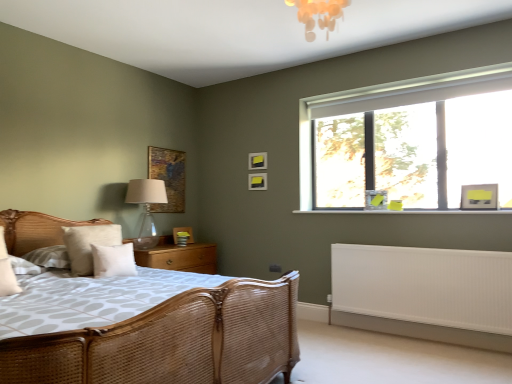
Question: Can you confirm if woven rattan bed at left is bigger than white ribbed radiator at lower right?

Choices:
 (A) no
 (B) yes

Answer: (B)

Question: Could you tell me if woven rattan bed at left is turned towards white ribbed radiator at lower right?

Choices:
 (A) no
 (B) yes

Answer: (A)

Question: From the image's perspective, would you say woven rattan bed at left is positioned over white ribbed radiator at lower right?

Choices:
 (A) yes
 (B) no

Answer: (A)

Question: Would you say woven rattan bed at left is a long distance from white ribbed radiator at lower right?

Choices:
 (A) no
 (B) yes

Answer: (B)

Question: From a real-world perspective, does woven rattan bed at left stand above white ribbed radiator at lower right?

Choices:
 (A) no
 (B) yes

Answer: (B)

Question: Does woven rattan bed at left lie behind white ribbed radiator at lower right?

Choices:
 (A) yes
 (B) no

Answer: (B)

Question: Does white soft pillow at center, the 1th pillow positioned from the right, come behind matte black picture frame at upper center, the 3th picture frame from the left?

Choices:
 (A) yes
 (B) no

Answer: (B)

Question: Is white soft pillow at center, the 1th pillow positioned from the right, at the right side of matte black picture frame at upper center, which is the third picture frame in back-to-front order?

Choices:
 (A) yes
 (B) no

Answer: (B)

Question: From a real-world perspective, is white soft pillow at center, acting as the second pillow starting from the left, under matte black picture frame at upper center, which appears as the 3th picture frame when viewed from the right?

Choices:
 (A) yes
 (B) no

Answer: (A)

Question: From the image's perspective, is white soft pillow at center, acting as the second pillow starting from the left, under matte black picture frame at upper center, which is the 3th picture frame from front to back?

Choices:
 (A) no
 (B) yes

Answer: (B)

Question: From the image's perspective, is white soft pillow at center, acting as the second pillow starting from the left, on top of matte black picture frame at upper center, the 3th picture frame from the left?

Choices:
 (A) yes
 (B) no

Answer: (B)

Question: Considering the relative sizes of white soft pillow at center, the 1th pillow positioned from the right, and matte black picture frame at upper center, which is the 3th picture frame from front to back, in the image provided, is white soft pillow at center, the 1th pillow positioned from the right, smaller than matte black picture frame at upper center, which is the 3th picture frame from front to back,?

Choices:
 (A) yes
 (B) no

Answer: (B)

Question: Does white ribbed radiator at lower right have a smaller size compared to wooden textured picture frame at upper center, which is the fifth picture frame from right to left?

Choices:
 (A) yes
 (B) no

Answer: (B)